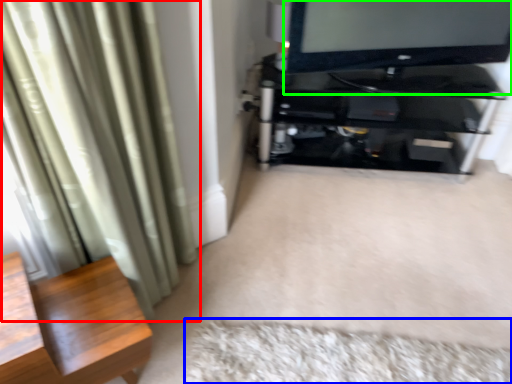
Question: Considering the real-world distances, which object is farthest from curtain (highlighted by a red box)? mat (highlighted by a blue box) or television (highlighted by a green box)?

Choices:
 (A) mat
 (B) television

Answer: (B)